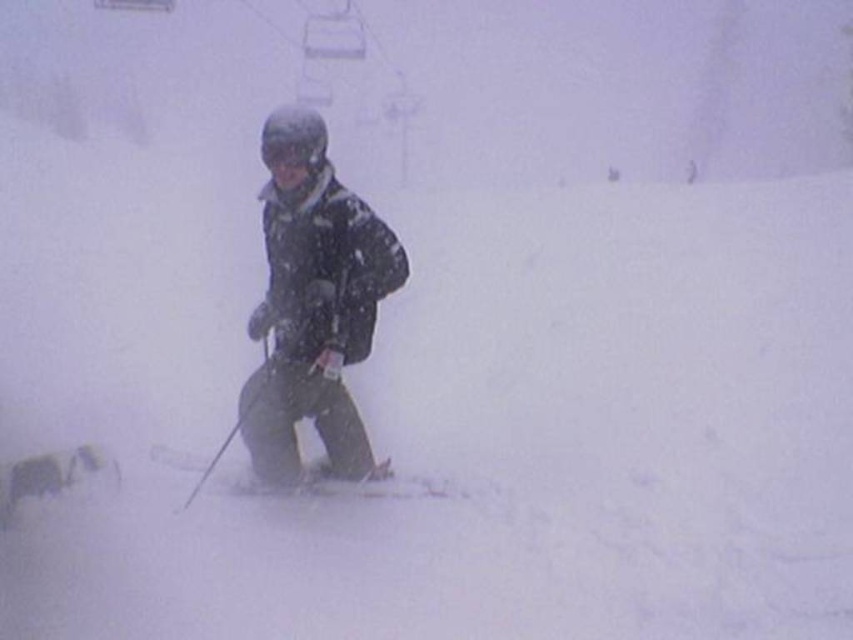
Does matte black ski at center appear under matte black goggles at center?

Indeed, matte black ski at center is positioned under matte black goggles at center.

Which is in front, point (202, 483) or point (276, 150)?

Point (276, 150) is in front.

Where is `matte black ski at center`? This screenshot has height=640, width=853. matte black ski at center is located at coordinates (294, 481).